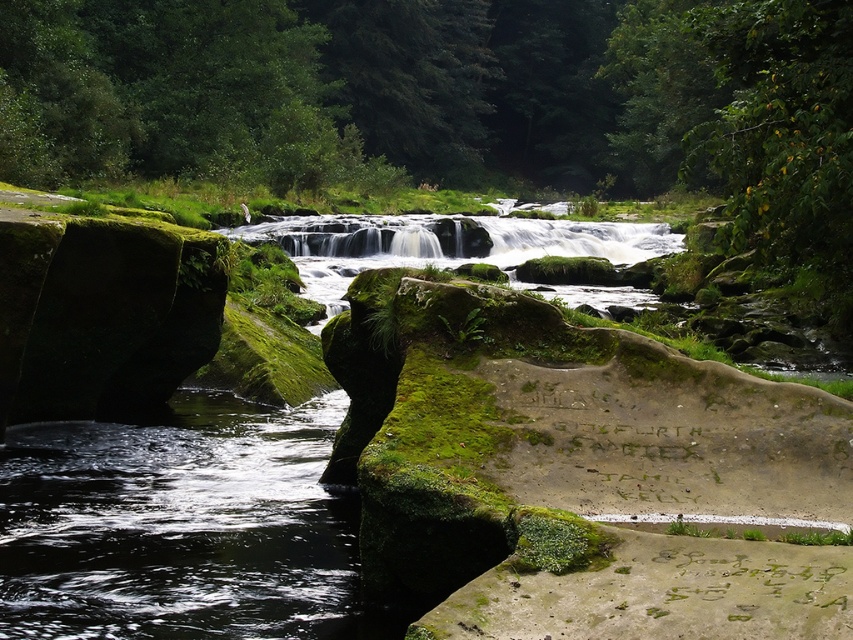
You are a hiker who wants to cross the stream using the rocks. The clear water at center is deeper than the white smooth water at center. Which part of the water should you step on to cross safely?

You should step on the white smooth water at center because it is shallower than the clear water at center, making it safer to cross.